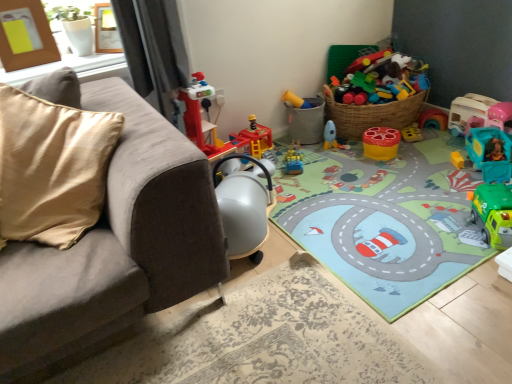
The height and width of the screenshot is (384, 512). What are the coordinates of `vacant space in between yellow matte stool at center, arranged as the 3th toy when viewed from the left, and shiny yellow plastic train at center, which appears as the first toy when viewed from the left` in the screenshot? It's located at (336, 158).